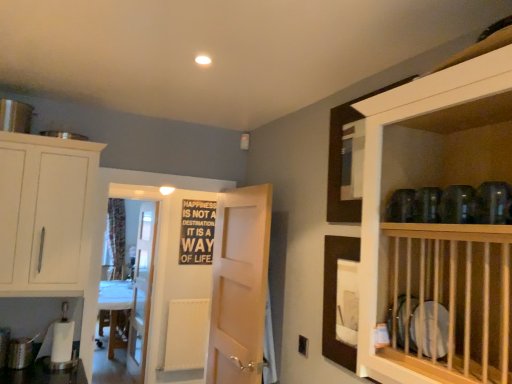
Question: Is white wood cabinet at left completely or partially outside of black matte sign at center?

Choices:
 (A) no
 (B) yes

Answer: (B)

Question: Does white wood cabinet at left come in front of black matte sign at center?

Choices:
 (A) no
 (B) yes

Answer: (B)

Question: Does white wood cabinet at left touch black matte sign at center?

Choices:
 (A) yes
 (B) no

Answer: (B)

Question: From a real-world perspective, is white wood cabinet at left beneath black matte sign at center?

Choices:
 (A) no
 (B) yes

Answer: (A)

Question: Does white wood cabinet at left have a lesser height compared to black matte sign at center?

Choices:
 (A) no
 (B) yes

Answer: (A)

Question: From a real-world perspective, is white wood cabinet at left over black matte sign at center?

Choices:
 (A) no
 (B) yes

Answer: (B)

Question: Is white wooden door at center, placed as the 2th door when sorted from front to back, placed right next to floral fabric curtain at left?

Choices:
 (A) no
 (B) yes

Answer: (A)

Question: Considering the relative positions of white wooden door at center, placed as the 2th door when sorted from front to back, and floral fabric curtain at left in the image provided, is white wooden door at center, placed as the 2th door when sorted from front to back, to the left of floral fabric curtain at left from the viewer's perspective?

Choices:
 (A) yes
 (B) no

Answer: (B)

Question: Is white wooden door at center, the first door viewed from the left, looking in the opposite direction of floral fabric curtain at left?

Choices:
 (A) no
 (B) yes

Answer: (A)

Question: Does white wooden door at center, acting as the first door starting from the back, have a lesser width compared to floral fabric curtain at left?

Choices:
 (A) yes
 (B) no

Answer: (A)

Question: Is white wooden door at center, placed as the 2th door when sorted from front to back, aimed at floral fabric curtain at left?

Choices:
 (A) yes
 (B) no

Answer: (B)

Question: Does white wooden door at center, the first door viewed from the left, appear on the right side of floral fabric curtain at left?

Choices:
 (A) yes
 (B) no

Answer: (A)

Question: Is white wood cabinet at left looking in the opposite direction of floral fabric curtain at left?

Choices:
 (A) no
 (B) yes

Answer: (B)